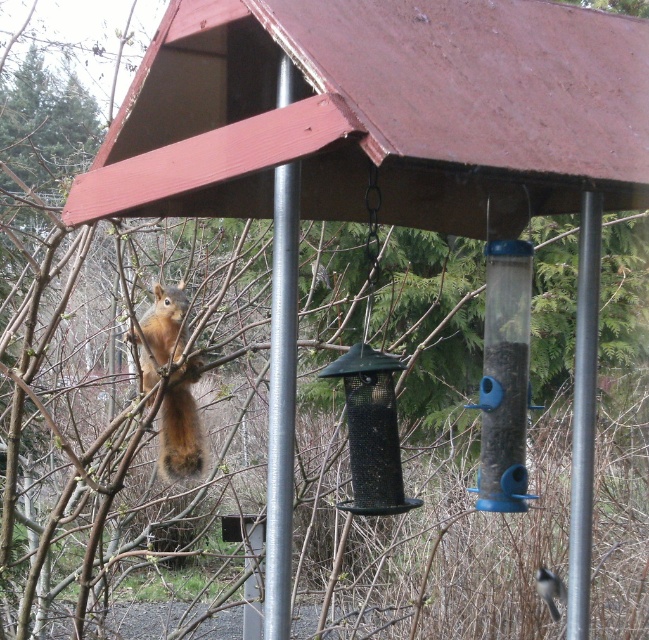
Question: Is brushed metal pole at center in front of metallic gray pole at center?

Choices:
 (A) no
 (B) yes

Answer: (B)

Question: Which of the following is the closest to the observer?

Choices:
 (A) metallic gray pole at center
 (B) brushed metal pole at center
 (C) shiny brown fur at left

Answer: (B)

Question: Does brushed metal pole at center have a greater width compared to metallic gray pole at center?

Choices:
 (A) yes
 (B) no

Answer: (B)

Question: Does brushed metal pole at center appear on the right side of metallic gray pole at center?

Choices:
 (A) no
 (B) yes

Answer: (A)

Question: Among these objects, which one is farthest from the camera?

Choices:
 (A) shiny brown fur at left
 (B) metallic gray pole at center

Answer: (A)

Question: Which object is closer to the camera taking this photo?

Choices:
 (A) metallic gray pole at center
 (B) brushed metal pole at center
 (C) shiny brown fur at left

Answer: (B)